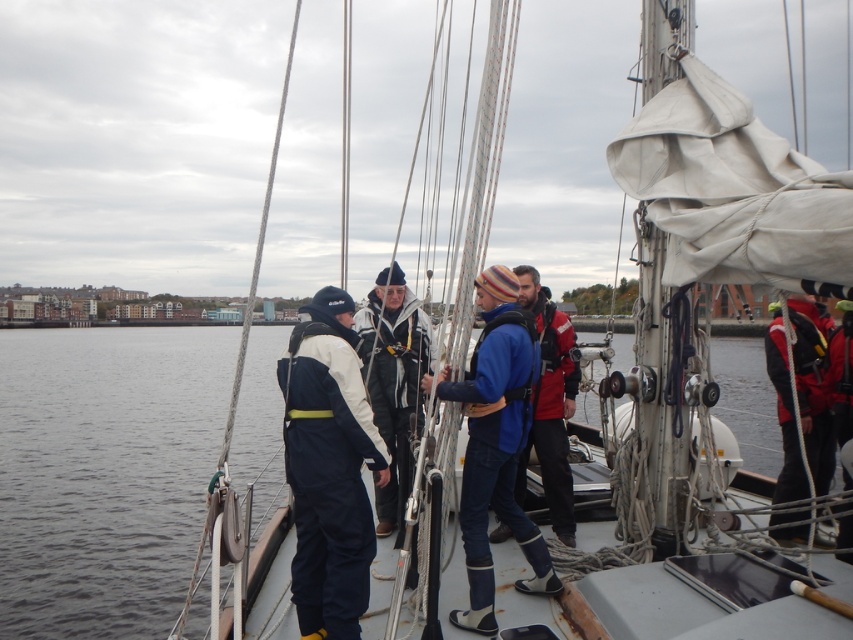
Question: Which object is closer to the camera taking this photo?

Choices:
 (A) navy blue waterproof jumpsuit at center
 (B) red life jacket at right
 (C) white matte jacket at center
 (D) transparent water at center

Answer: (A)

Question: Observing the image, what is the correct spatial positioning of transparent water at center in reference to navy blue waterproof jumpsuit at center?

Choices:
 (A) above
 (B) below

Answer: (B)

Question: Which of the following is the closest to the observer?

Choices:
 (A) white matte jacket at center
 (B) red life jacket at right
 (C) blue fabric jacket at center

Answer: (B)

Question: Can you confirm if navy blue waterproof jumpsuit at center is positioned to the right of red life jacket at right?

Choices:
 (A) no
 (B) yes

Answer: (A)

Question: Does transparent water at center have a greater width compared to blue fabric jacket at center?

Choices:
 (A) yes
 (B) no

Answer: (A)

Question: Which point is closer to the camera taking this photo?

Choices:
 (A) [352, 419]
 (B) [80, 333]

Answer: (A)